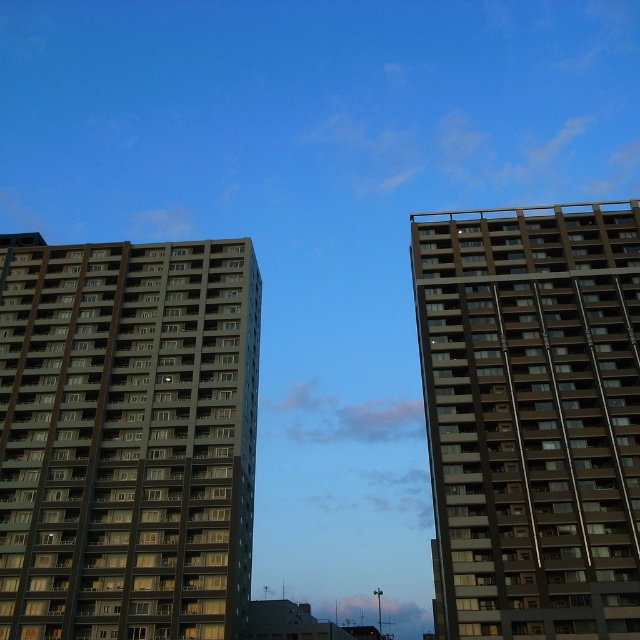
You are a drone operator trying to fly a drone between the two buildings. The drone has a wingspan of 1 meter. Based on the scene, can the drone safely pass between the dark gray concrete building at left and the brown glassy building at right?

The dark gray concrete building at left is positioned over the brown glassy building at right, meaning there is no horizontal space between them for the drone to pass through. Therefore, the drone cannot safely fly between them.

You are standing in front of two buildings. You see the dark gray concrete building at left and the brown glassy building at right. Which one is positioned more to the east if the sun is setting in the west?

The dark gray concrete building at left is positioned more to the east because it is to the left of the brown glassy building at right, and since the sun is setting in the west, the left side would face east.